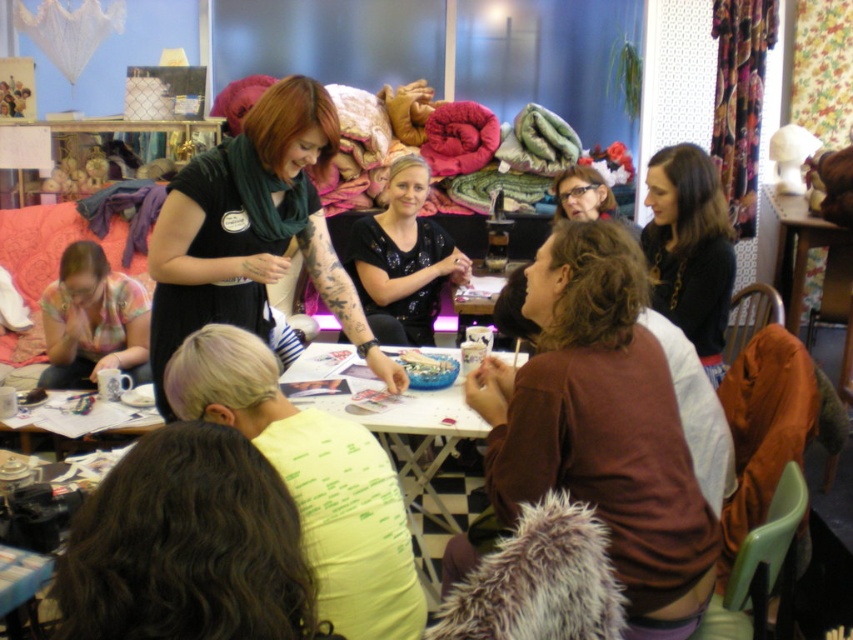
Who is positioned more to the left, brown fuzzy sweater at center or white glossy table at center?

From the viewer's perspective, white glossy table at center appears more on the left side.

At what (x,y) coordinates should I click in order to perform the action: click on brown fuzzy sweater at center. Please return your answer as a coordinate pair (x, y). Image resolution: width=853 pixels, height=640 pixels. Looking at the image, I should click on (601, 426).

Measure the distance between point (515, 396) and camera.

A distance of 1.56 meters exists between point (515, 396) and camera.

Identify the location of brown fuzzy sweater at center. This screenshot has width=853, height=640. (601, 426).

Is brown fuzzy sweater at center closer to camera compared to matte brown hair at center?

Yes.

Is point (657, 502) behind point (596, 195)?

No, it is not.

At what (x,y) coordinates should I click in order to perform the action: click on brown fuzzy sweater at center. Please return your answer as a coordinate pair (x, y). The image size is (853, 640). Looking at the image, I should click on (601, 426).

Locate an element on the screen. brown fuzzy sweater at center is located at coordinates (601, 426).

Does white glossy table at center have a greater width compared to floral fabric shirt at lower left?

Indeed, white glossy table at center has a greater width compared to floral fabric shirt at lower left.

Does white glossy table at center appear on the right side of floral fabric shirt at lower left?

Indeed, white glossy table at center is positioned on the right side of floral fabric shirt at lower left.

Where is `white glossy table at center`? The width and height of the screenshot is (853, 640). white glossy table at center is located at coordinates (408, 449).